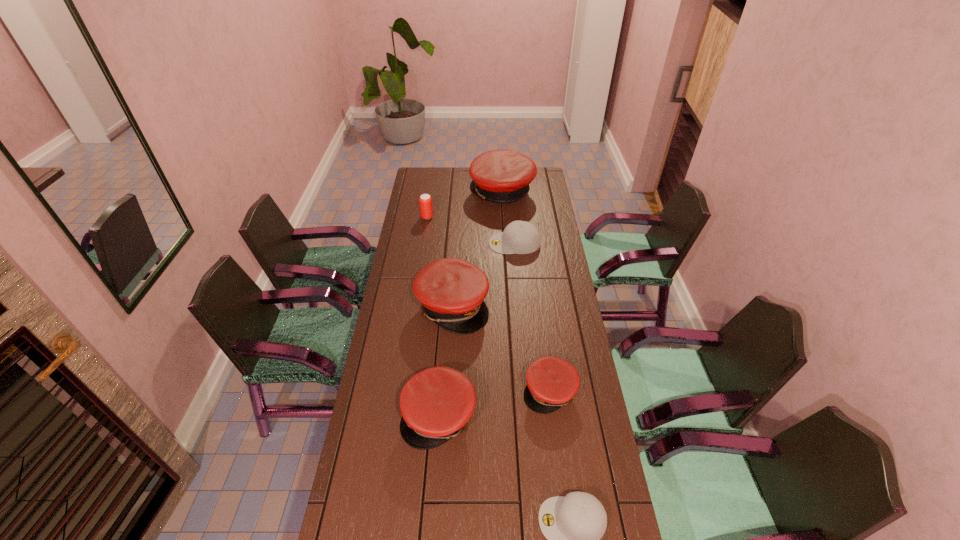
Find the location of a particular element. The width and height of the screenshot is (960, 540). the tallest object is located at coordinates (503, 176).

Identify the location of the tallest cap. (503, 176).

The width and height of the screenshot is (960, 540). I want to click on the second tallest object, so click(x=452, y=291).

This screenshot has width=960, height=540. Identify the location of the fourth nearest cap. (452, 291).

At what (x,y) coordinates should I click in order to perform the action: click on the second farthest object. Please return your answer as a coordinate pair (x, y). Image resolution: width=960 pixels, height=540 pixels. Looking at the image, I should click on (425, 201).

You are a GUI agent. You are given a task and a screenshot of the screen. Output one action in this format:
    pyautogui.click(x=<x>, y=<y>)
    Task: Click on the red beer can
    The image size is (960, 540).
    Given the screenshot: What is the action you would take?
    pyautogui.click(x=425, y=201)

Identify the location of the second smallest red cap. The height and width of the screenshot is (540, 960). (436, 403).

I want to click on the second farthest cap, so click(520, 237).

Locate an element on the screen. Image resolution: width=960 pixels, height=540 pixels. the farther gray cap is located at coordinates (520, 237).

The image size is (960, 540). I want to click on the smallest red cap, so click(552, 382).